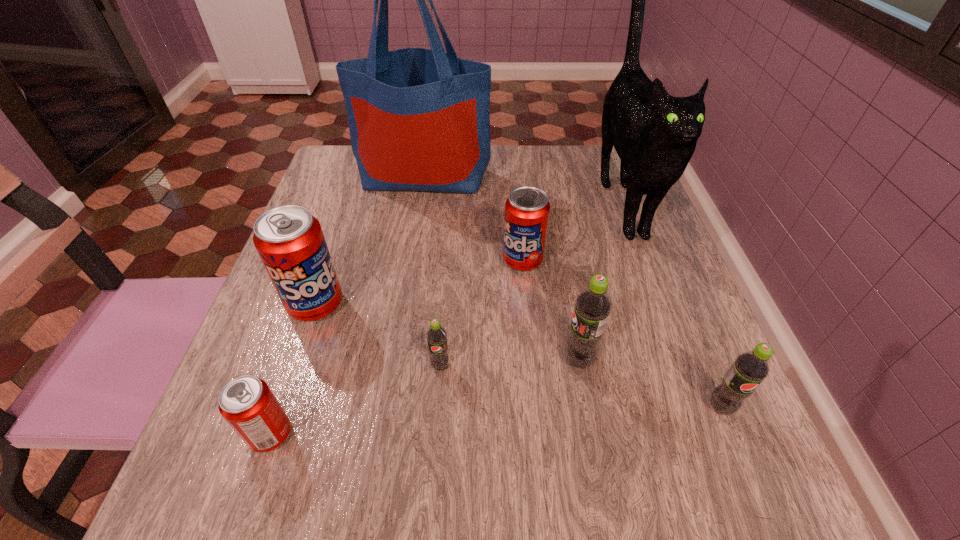
You are a GUI agent. You are given a task and a screenshot of the screen. Output one action in this format:
    pyautogui.click(x=<x>, y=<y>)
    Task: Click on the leftmost green soda
    Image resolution: width=960 pixels, height=540 pixels.
    Given the screenshot: What is the action you would take?
    pyautogui.click(x=436, y=335)

The height and width of the screenshot is (540, 960). I want to click on the smallest green soda, so click(x=436, y=335).

Find the location of a particular element. The height and width of the screenshot is (540, 960). the smallest red soda can is located at coordinates (247, 403).

Locate an element on the screen. blank space located on the front of the handbag is located at coordinates (399, 333).

You are a GUI agent. You are given a task and a screenshot of the screen. Output one action in this format:
    pyautogui.click(x=<x>, y=<y>)
    Task: Click on the vacant region located 0.310m on the face of the black cat
    The width and height of the screenshot is (960, 540).
    Given the screenshot: What is the action you would take?
    pyautogui.click(x=696, y=405)

Where is `free region located on the back of the fourth farthest object`? The image size is (960, 540). free region located on the back of the fourth farthest object is located at coordinates (348, 211).

Locate an element on the screen. This screenshot has width=960, height=540. blank space located 0.110m on the front label of the third object from right to left is located at coordinates (496, 360).

At what (x,y) coordinates should I click in order to perform the action: click on free space located 0.300m on the front label of the third object from right to left. Please return your answer as a coordinate pair (x, y). The height and width of the screenshot is (540, 960). Looking at the image, I should click on (382, 360).

This screenshot has height=540, width=960. I want to click on free space located 0.250m on the front label of the third object from right to left, so click(412, 360).

The width and height of the screenshot is (960, 540). What are the coordinates of `vacant region located 0.100m on the right of the second biggest red soda can` in the screenshot? It's located at (591, 260).